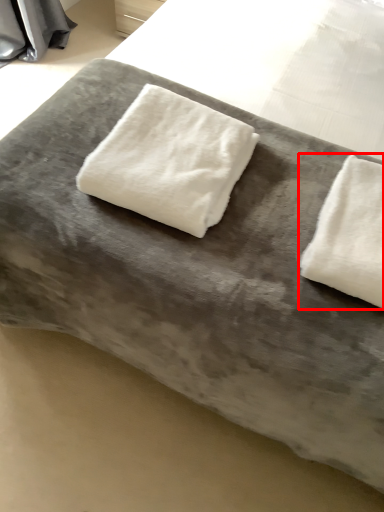
Question: From the image, what is the correct spatial relationship of towel (annotated by the red box) in relation to towel?

Choices:
 (A) right
 (B) left

Answer: (A)